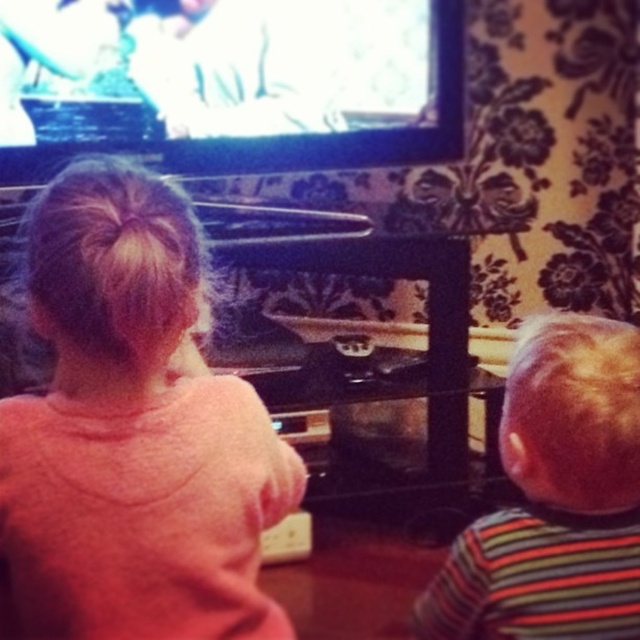
You are a parent trying to choose the right size of a gift box for two children in the scene. The pink fleece sweatshirt at upper left and the striped fabric shirt at right are the items you want to gift. Which child should receive the larger gift box based on the size of their clothing?

The pink fleece sweatshirt at upper left is larger in width than the striped fabric shirt at right, so the child wearing the pink fleece sweatshirt at upper left should receive the larger gift box.